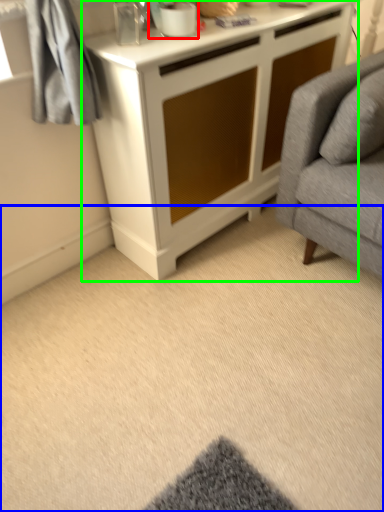
Question: Which object is positioned closest to appliance (highlighted by a red box)? Select from plain (highlighted by a blue box) and cabinetry (highlighted by a green box).

Choices:
 (A) plain
 (B) cabinetry

Answer: (B)